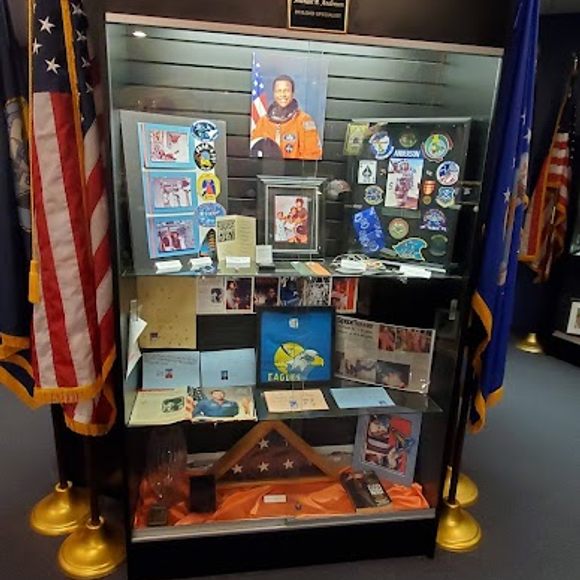
The image size is (580, 580). I want to click on newspaper clipping upright on shelf, so click(x=378, y=350).